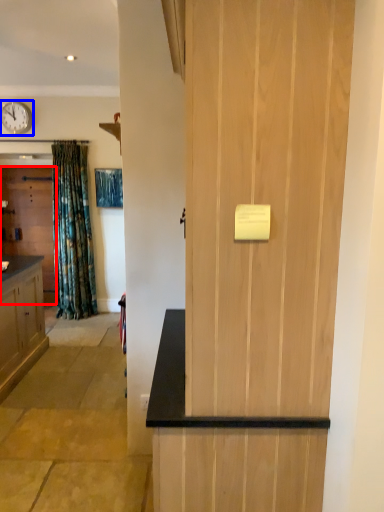
Question: Which of the following is the farthest to the observer, door (highlighted by a red box) or clock (highlighted by a blue box)?

Choices:
 (A) door
 (B) clock

Answer: (A)